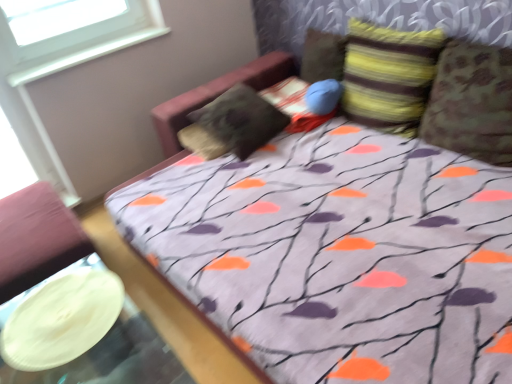
Question: Looking at their shapes, would you say striped fabric pillow at upper right, positioned as the 3th pillow in left-to-right order, is wider or thinner than striped fabric pillow at upper center, the second pillow from the left?

Choices:
 (A) thin
 (B) wide

Answer: (B)

Question: From the image's perspective, is striped fabric pillow at upper right, positioned as the 3th pillow in left-to-right order, located above or below striped fabric pillow at upper center, the second pillow from the left?

Choices:
 (A) above
 (B) below

Answer: (B)

Question: Which object is the farthest from the white glossy platter at lower left?

Choices:
 (A) camouflage fabric pillow at right, which ranks as the 1th pillow in right-to-left order
 (B) striped fabric pillow at upper right, positioned as the 3th pillow in left-to-right order
 (C) velvety brown pillow at center, marked as the 4th pillow in a right-to-left arrangement
 (D) striped fabric pillow at upper center, which is the 3th pillow from right to left
 (E) white plastic window at upper left

Answer: (D)

Question: Estimate the real-world distances between objects in this image. Which object is farther from the velvety brown pillow at center, which ranks as the first pillow in left-to-right order?

Choices:
 (A) white plastic window at upper left
 (B) white glossy platter at lower left
 (C) camouflage fabric pillow at right, the 4th pillow positioned from the left
 (D) striped fabric pillow at upper center, which is the 3th pillow from right to left
 (E) striped fabric pillow at upper right, positioned as the 3th pillow in left-to-right order

Answer: (B)